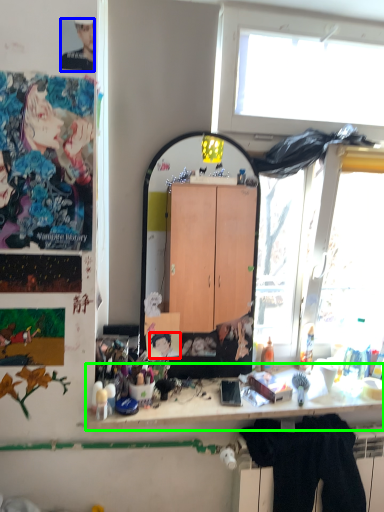
Question: Which is farther away from person (highlighted by a red box)? person (highlighted by a blue box) or desk (highlighted by a green box)?

Choices:
 (A) person
 (B) desk

Answer: (A)